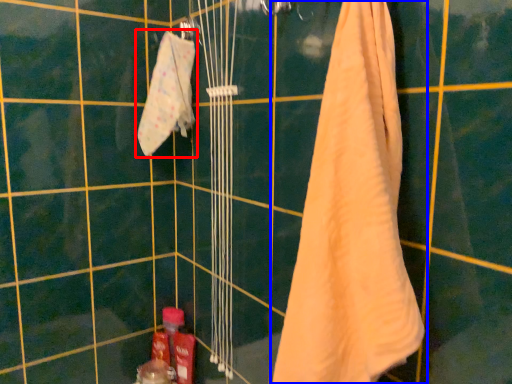
Question: Which point is further to the camera, towel (highlighted by a red box) or towel (highlighted by a blue box)?

Choices:
 (A) towel
 (B) towel

Answer: (A)